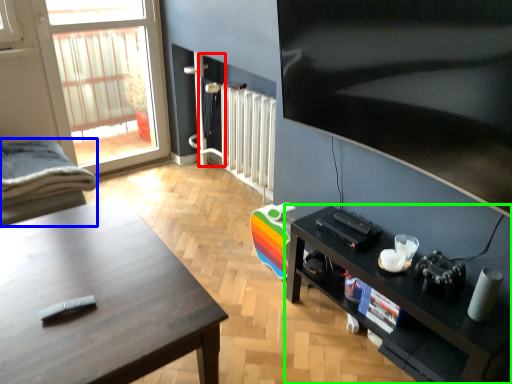
Question: Estimate the real-world distances between objects in this image. Which object is closer to screen door (highlighted by a red box), chair (highlighted by a blue box) or shelf (highlighted by a green box)?

Choices:
 (A) chair
 (B) shelf

Answer: (A)